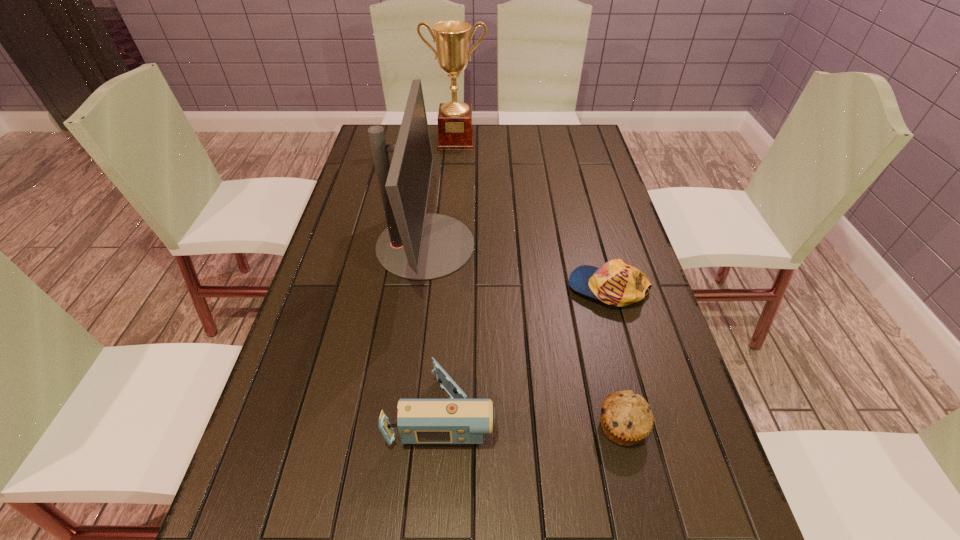
Identify the location of free area in between the muffin and the cap. (615, 357).

Where is `object identified as the third closest to the cap`? Image resolution: width=960 pixels, height=540 pixels. object identified as the third closest to the cap is located at coordinates (459, 420).

Select which object appears as the fourth closest to the third tallest object. Please provide its 2D coordinates. Your answer should be formatted as a tuple, i.e. [(x, y)], where the tuple contains the x and y coordinates of a point satisfying the conditions above.

[(452, 39)]

Where is `free space that satisfies the following two spatial constraints: 1. on the plaque of the muffin; 2. on the left side of the farthest object`? free space that satisfies the following two spatial constraints: 1. on the plaque of the muffin; 2. on the left side of the farthest object is located at coordinates (435, 427).

Image resolution: width=960 pixels, height=540 pixels. I want to click on free location that satisfies the following two spatial constraints: 1. on the plaque of the muffin; 2. on the right side of the farthest object, so click(435, 427).

You are a GUI agent. You are given a task and a screenshot of the screen. Output one action in this format:
    pyautogui.click(x=<x>, y=<y>)
    Task: Click on the free space that satisfies the following two spatial constraints: 1. on the screen of the muffin; 2. on the left side of the computer monitor
    The width and height of the screenshot is (960, 540).
    Given the screenshot: What is the action you would take?
    click(402, 427)